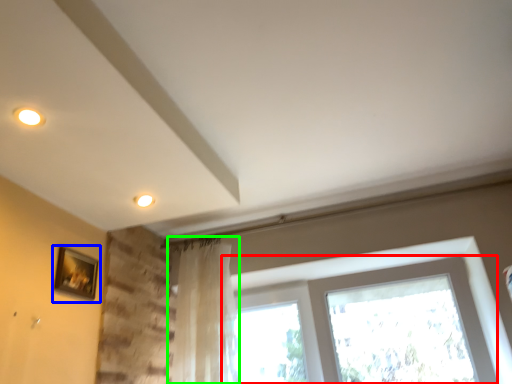
Question: Estimate the real-world distances between objects in this image. Which object is farther from window (highlighted by a red box), picture frame (highlighted by a blue box) or curtain (highlighted by a green box)?

Choices:
 (A) picture frame
 (B) curtain

Answer: (A)